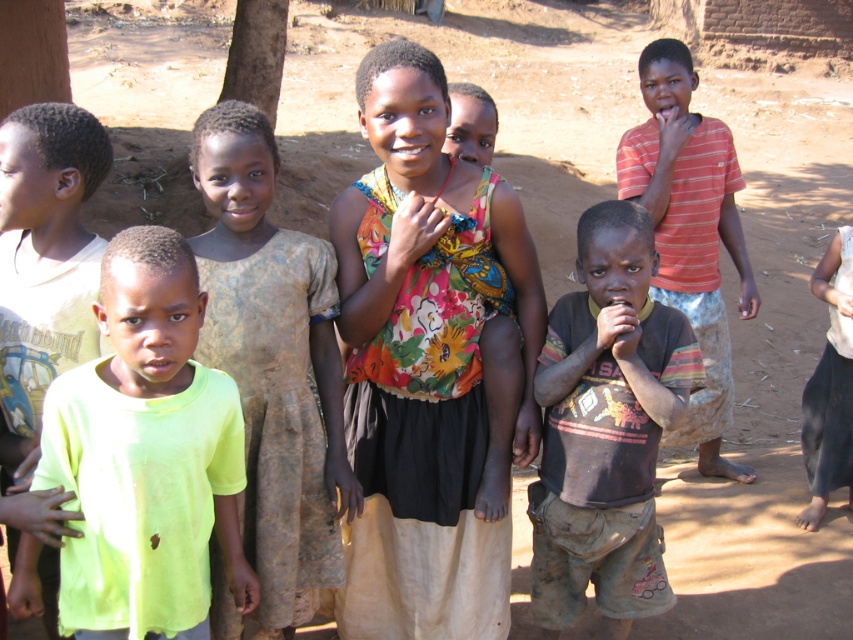
Question: Is brown textured dress at center smaller than dirty brown shirt at center?

Choices:
 (A) yes
 (B) no

Answer: (A)

Question: Which point is farther to the camera?

Choices:
 (A) light green t-shirt at left
 (B) brown textured dress at center
 (C) neon yellow t-shirt at left

Answer: (B)

Question: Which object is the farthest from the brown textured dress at center?

Choices:
 (A) striped cotton shirt at right
 (B) floral fabric dress at center

Answer: (A)

Question: Can you confirm if neon yellow t-shirt at left is positioned to the left of dirty brown shirt at center?

Choices:
 (A) yes
 (B) no

Answer: (A)

Question: Among these objects, which one is nearest to the camera?

Choices:
 (A) light green t-shirt at left
 (B) brown textured dress at center
 (C) dirty brown shirt at center

Answer: (A)

Question: Does neon yellow t-shirt at left have a smaller size compared to striped cotton shirt at right?

Choices:
 (A) yes
 (B) no

Answer: (A)